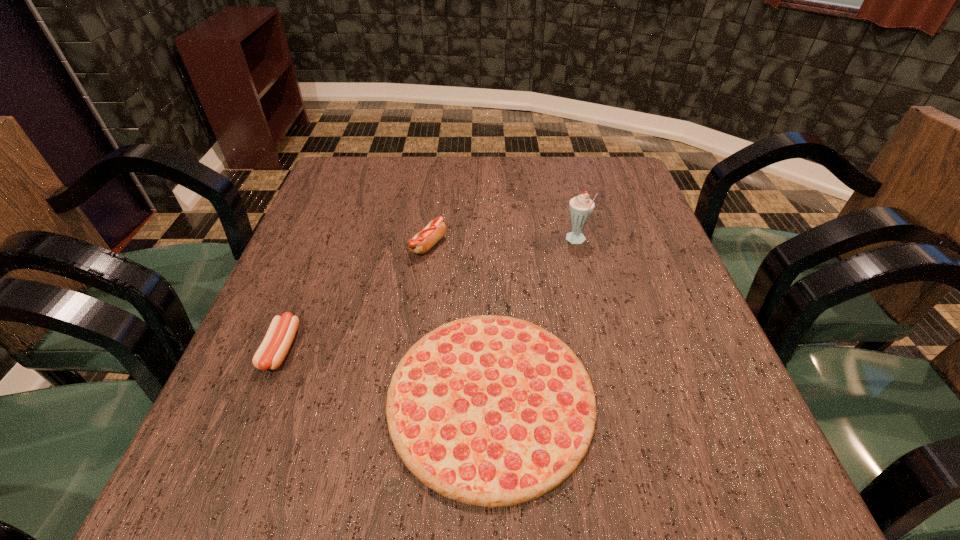
Locate an element on the screen. The height and width of the screenshot is (540, 960). vacant space located on the front of the farther sausage is located at coordinates (423, 286).

In order to click on free location located on the back of the leftmost object in this screenshot , I will do `click(314, 266)`.

Where is `vacant space situated on the left of the shortest object`? The width and height of the screenshot is (960, 540). vacant space situated on the left of the shortest object is located at coordinates (299, 398).

You are a GUI agent. You are given a task and a screenshot of the screen. Output one action in this format:
    pyautogui.click(x=<x>, y=<y>)
    Task: Click on the object present at the near edge
    The image size is (960, 540).
    Given the screenshot: What is the action you would take?
    pyautogui.click(x=492, y=411)

This screenshot has width=960, height=540. Identify the location of object at the left edge. (279, 337).

Locate an element on the screen. vacant space at the far edge is located at coordinates (543, 187).

This screenshot has height=540, width=960. What are the coordinates of `blank area at the left edge` in the screenshot? It's located at (309, 432).

Locate an element on the screen. Image resolution: width=960 pixels, height=540 pixels. vacant space at the right edge is located at coordinates (679, 302).

At what (x,y) coordinates should I click in order to perform the action: click on vacant region at the far right corner of the desktop. Please return your answer as a coordinate pair (x, y). Looking at the image, I should click on (602, 172).

At what (x,y) coordinates should I click in order to perform the action: click on vacant space that is in between the second shortest object and the tallest object. Please return your answer as a coordinate pair (x, y). The height and width of the screenshot is (540, 960). Looking at the image, I should click on (428, 295).